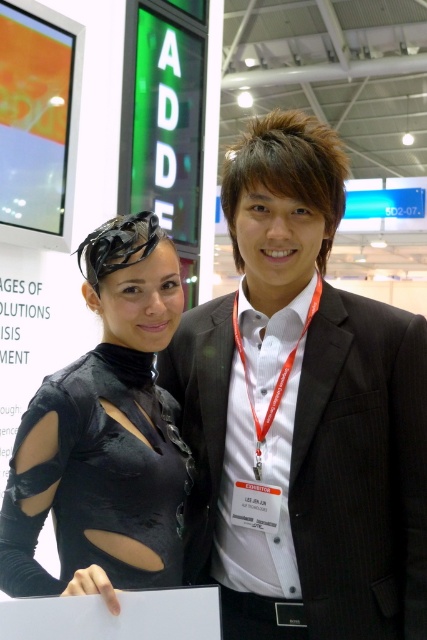
Question: Is black pinstripe suit at center wider than matte black dress at center?

Choices:
 (A) no
 (B) yes

Answer: (B)

Question: Observing the image, what is the correct spatial positioning of black pinstripe suit at center in reference to matte black dress at center?

Choices:
 (A) left
 (B) right

Answer: (B)

Question: Which point appears closest to the camera in this image?

Choices:
 (A) (166, 538)
 (B) (391, 433)

Answer: (A)

Question: Which point is closer to the camera?

Choices:
 (A) (351, 579)
 (B) (128, 570)

Answer: (B)

Question: Which point is closer to the camera?

Choices:
 (A) (178, 529)
 (B) (301, 189)

Answer: (B)

Question: Does black pinstripe suit at center have a larger size compared to matte black dress at center?

Choices:
 (A) yes
 (B) no

Answer: (A)